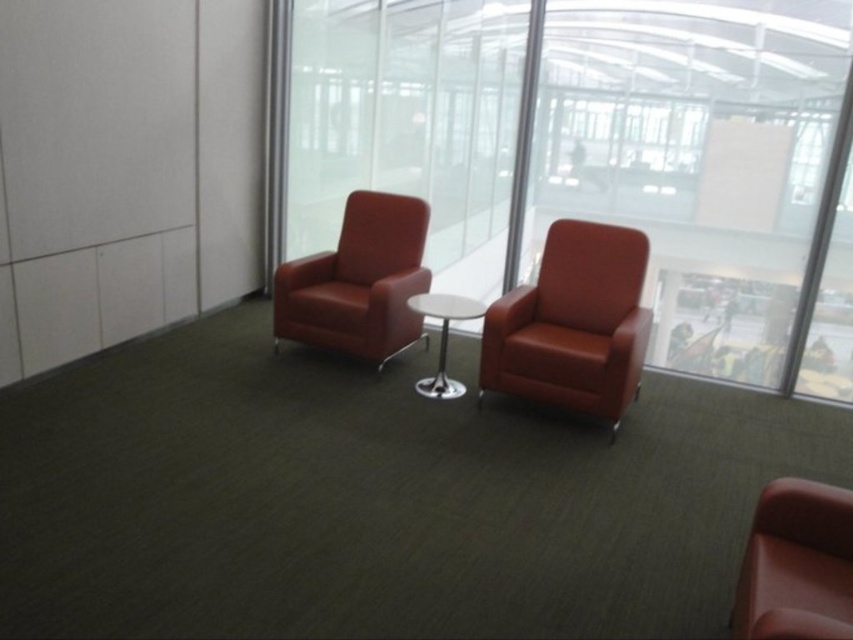
Is transparent glass window at center in front of white glossy table at center?

No, transparent glass window at center is behind white glossy table at center.

Based on the photo, who is more distant from viewer, (828, 42) or (463, 317)?

Point (828, 42)

Between point (770, 362) and point (450, 396), which one is positioned in front?

Point (450, 396)

You are a GUI agent. You are given a task and a screenshot of the screen. Output one action in this format:
    pyautogui.click(x=<x>, y=<y>)
    Task: Click on the transparent glass window at center
    The width and height of the screenshot is (853, 640).
    Given the screenshot: What is the action you would take?
    pyautogui.click(x=587, y=145)

Which is in front, point (498, 388) or point (445, 339)?

Point (498, 388)

Does suede leather armchair at center have a lesser height compared to white glossy table at center?

No, suede leather armchair at center is not shorter than white glossy table at center.

This screenshot has height=640, width=853. Describe the element at coordinates (573, 323) in the screenshot. I see `suede leather armchair at center` at that location.

Identify the location of suede leather armchair at center. The image size is (853, 640). coord(573,323).

Consider the image. Does transparent glass window at center have a lesser width compared to suede leather armchair at center?

No.

Is point (735, 58) positioned in front of point (480, 362)?

No, (735, 58) is behind (480, 362).

Where is `transparent glass window at center`? This screenshot has height=640, width=853. transparent glass window at center is located at coordinates (587, 145).